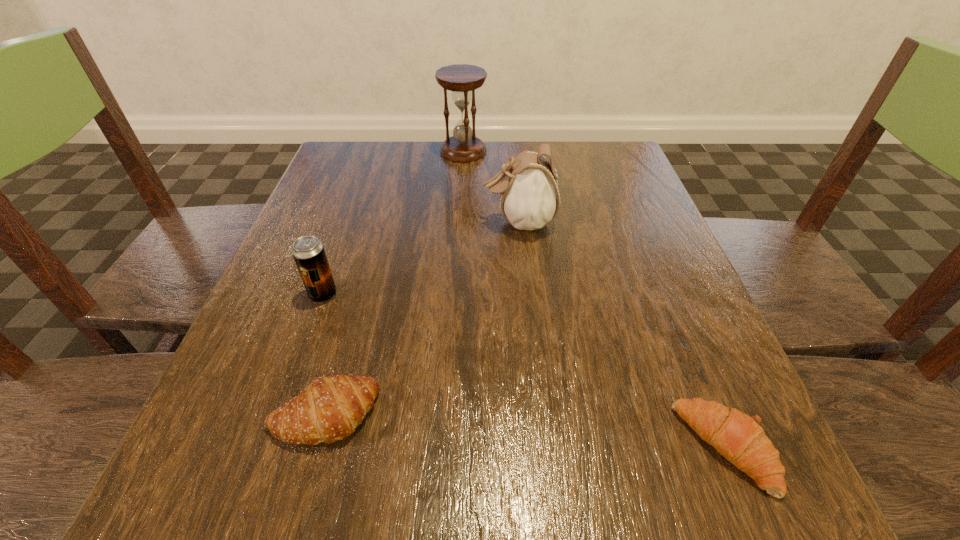
Where is `vacant point located 0.290m on the front-facing side of the second tallest object`? The height and width of the screenshot is (540, 960). vacant point located 0.290m on the front-facing side of the second tallest object is located at coordinates (342, 222).

I want to click on free location located on the front-facing side of the second tallest object, so click(404, 222).

This screenshot has width=960, height=540. I want to click on free space located on the front-facing side of the second tallest object, so click(312, 222).

The image size is (960, 540). Identify the location of free space located 0.140m on the right of the beer can. (418, 294).

This screenshot has height=540, width=960. Identify the location of free space located 0.160m on the right of the left crescent roll. (494, 414).

Identify the location of free space located 0.080m on the back of the right crescent roll. Image resolution: width=960 pixels, height=540 pixels. (686, 356).

Find the location of a particular element. The image size is (960, 540). object that is positioned at the far edge is located at coordinates (461, 79).

Locate an element on the screen. The image size is (960, 540). beer can at the left edge is located at coordinates click(308, 252).

You are a GUI agent. You are given a task and a screenshot of the screen. Output one action in this format:
    pyautogui.click(x=<x>, y=<y>)
    Task: Click on the crescent roll at the left edge
    The image size is (960, 540).
    Given the screenshot: What is the action you would take?
    pyautogui.click(x=329, y=409)

Locate an element on the screen. The height and width of the screenshot is (540, 960). object that is positioned at the right edge is located at coordinates (739, 438).